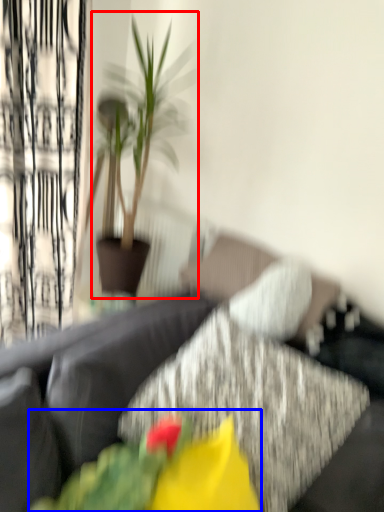
Question: Among these objects, which one is nearest to the camera, houseplant (highlighted by a red box) or floral arrangement (highlighted by a blue box)?

Choices:
 (A) houseplant
 (B) floral arrangement

Answer: (B)